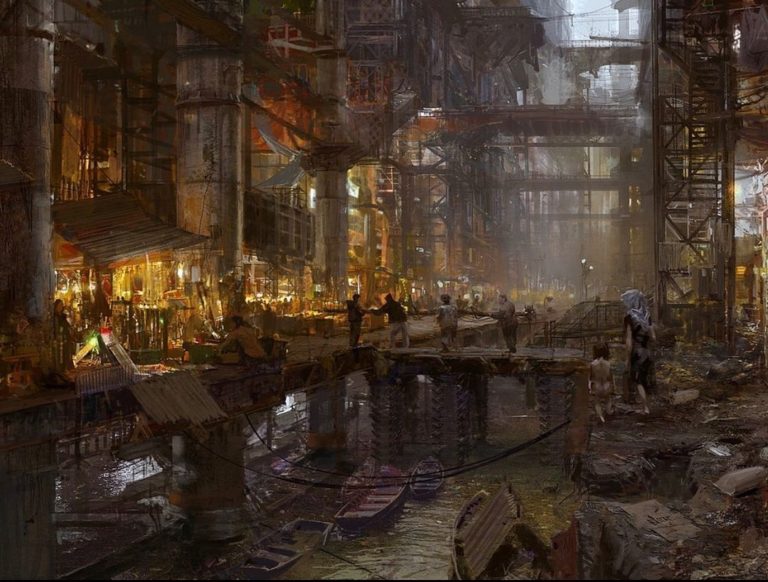
Image resolution: width=768 pixels, height=582 pixels. I want to click on painting, so click(527, 170).